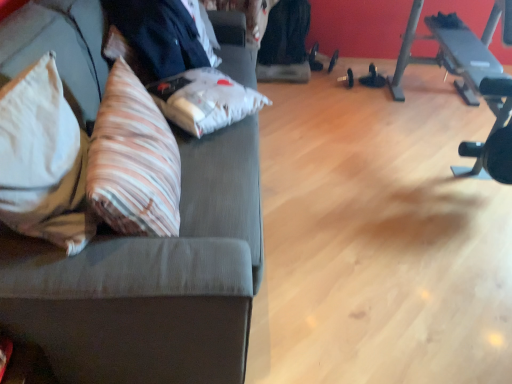
Question: Can you confirm if black fabric businessman at upper left is thinner than striped fabric throw pillow at left, which appears as the second throw pillow when viewed from the left?

Choices:
 (A) no
 (B) yes

Answer: (A)

Question: Does black fabric businessman at upper left come in front of striped fabric throw pillow at left, which is counted as the first throw pillow, starting from the right?

Choices:
 (A) no
 (B) yes

Answer: (A)

Question: Is black fabric businessman at upper left oriented towards striped fabric throw pillow at left, which is counted as the first throw pillow, starting from the right?

Choices:
 (A) no
 (B) yes

Answer: (A)

Question: Is black fabric businessman at upper left positioned with its back to striped fabric throw pillow at left, which is counted as the first throw pillow, starting from the right?

Choices:
 (A) no
 (B) yes

Answer: (A)

Question: Is black fabric businessman at upper left bigger than striped fabric throw pillow at left, which appears as the second throw pillow when viewed from the left?

Choices:
 (A) no
 (B) yes

Answer: (B)

Question: Relative to black rubber dumbbell at center, is striped fabric throw pillow at left, which appears as the second throw pillow when viewed from the left, in front or behind?

Choices:
 (A) front
 (B) behind

Answer: (A)

Question: Looking at their shapes, would you say striped fabric throw pillow at left, which is counted as the first throw pillow, starting from the right, is wider or thinner than black rubber dumbbell at center?

Choices:
 (A) thin
 (B) wide

Answer: (B)

Question: Would you say striped fabric throw pillow at left, which appears as the second throw pillow when viewed from the left, is to the left or to the right of black rubber dumbbell at center in the picture?

Choices:
 (A) left
 (B) right

Answer: (A)

Question: Choose the correct answer: Is striped fabric throw pillow at left, which appears as the second throw pillow when viewed from the left, inside black rubber dumbbell at center or outside it?

Choices:
 (A) inside
 (B) outside

Answer: (B)

Question: Considering the relative positions of black rubber barbell at right and beige fabric pillow at left, marked as the 1th throw pillow in a left-to-right arrangement, in the image provided, is black rubber barbell at right to the left or to the right of beige fabric pillow at left, marked as the 1th throw pillow in a left-to-right arrangement,?

Choices:
 (A) left
 (B) right

Answer: (B)

Question: Is black rubber barbell at right inside the boundaries of beige fabric pillow at left, marked as the 1th throw pillow in a left-to-right arrangement, or outside?

Choices:
 (A) inside
 (B) outside

Answer: (B)

Question: From a real-world perspective, is black rubber barbell at right above or below beige fabric pillow at left, marked as the 1th throw pillow in a left-to-right arrangement?

Choices:
 (A) below
 (B) above

Answer: (A)

Question: Is point (502, 117) positioned closer to the camera than point (31, 92)?

Choices:
 (A) closer
 (B) farther

Answer: (B)

Question: In the image, is striped fabric throw pillow at left, which is counted as the first throw pillow, starting from the right, on the left side or the right side of textured gray couch at left?

Choices:
 (A) right
 (B) left

Answer: (A)

Question: From a real-world perspective, is striped fabric throw pillow at left, which is counted as the first throw pillow, starting from the right, above or below textured gray couch at left?

Choices:
 (A) below
 (B) above

Answer: (B)